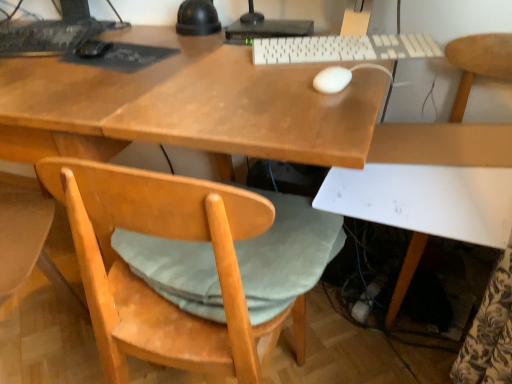
You are a GUI agent. You are given a task and a screenshot of the screen. Output one action in this format:
    pyautogui.click(x=<x>, y=<y>)
    Task: Click on the free area in between white matte mouse at center, which ranks as the 2th mouse in left-to-right order, and dark gray matte mousepad at upper left
    The image size is (512, 384).
    Given the screenshot: What is the action you would take?
    pyautogui.click(x=226, y=67)